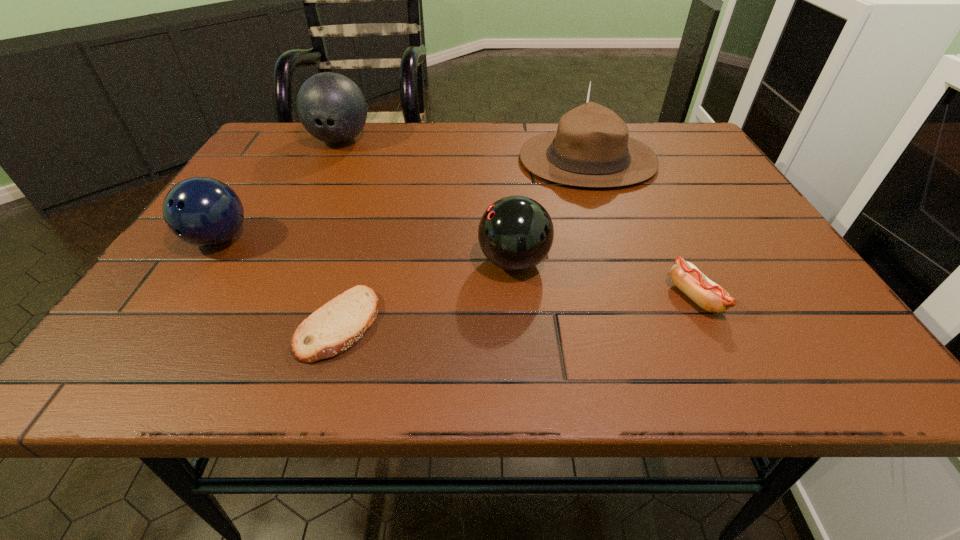
Identify which object is the fourth nearest to the rightmost bowling ball. Please provide its 2D coordinates. Your answer should be formatted as a tuple, i.e. [(x, y)], where the tuple contains the x and y coordinates of a point satisfying the conditions above.

[(331, 107)]

Select which object appears as the third closest to the sausage. Please provide its 2D coordinates. Your answer should be formatted as a tuple, i.e. [(x, y)], where the tuple contains the x and y coordinates of a point satisfying the conditions above.

[(337, 325)]

At what (x,y) coordinates should I click in order to perform the action: click on bowling ball identified as the second closest to the fedora. Please return your answer as a coordinate pair (x, y). Looking at the image, I should click on (331, 107).

The image size is (960, 540). I want to click on bowling ball object that ranks as the second closest to the pita bread, so click(x=201, y=211).

You are a GUI agent. You are given a task and a screenshot of the screen. Output one action in this format:
    pyautogui.click(x=<x>, y=<y>)
    Task: Click on the vacant position in the image that satisfies the following two spatial constraints: 1. on the back side of the sausage; 2. on the surface of the rightmost bowling ball near the finger holes
    Image resolution: width=960 pixels, height=540 pixels.
    Given the screenshot: What is the action you would take?
    pyautogui.click(x=678, y=262)

Where is `free space in the image that satisfies the following two spatial constraints: 1. on the grip area of the shortest object; 2. on the right side of the tallest bowling ball`? The width and height of the screenshot is (960, 540). free space in the image that satisfies the following two spatial constraints: 1. on the grip area of the shortest object; 2. on the right side of the tallest bowling ball is located at coordinates (251, 324).

Identify the location of free space that satisfies the following two spatial constraints: 1. on the surface of the second shortest object near the finger holes; 2. on the left side of the rightmost bowling ball. (516, 298).

Find the location of a particular element. This screenshot has height=540, width=960. blank space that satisfies the following two spatial constraints: 1. on the feather side of the fedora; 2. on the front side of the shortest object is located at coordinates (644, 324).

Where is `free location that satisfies the following two spatial constraints: 1. on the surface of the fifth tallest object near the finger holes; 2. on the left side of the rightmost bowling ball`? free location that satisfies the following two spatial constraints: 1. on the surface of the fifth tallest object near the finger holes; 2. on the left side of the rightmost bowling ball is located at coordinates (516, 298).